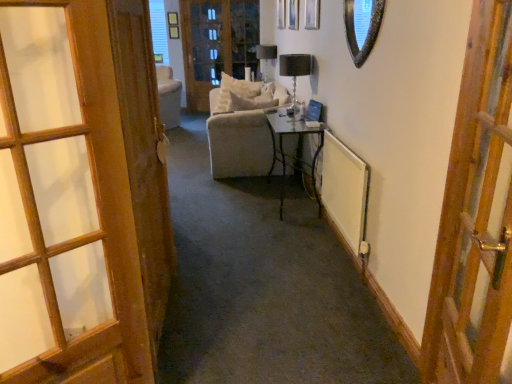
Find the location of a particular element. This screenshot has width=512, height=384. wooden door at left, acting as the first door starting from the left is located at coordinates (80, 194).

You are a GUI agent. You are given a task and a screenshot of the screen. Output one action in this format:
    pyautogui.click(x=<x>, y=<y>)
    Task: Click on the clear glass screen door at upper center
    The height and width of the screenshot is (384, 512).
    Given the screenshot: What is the action you would take?
    pyautogui.click(x=217, y=44)

What is the approximate width of black glass table lamp at center, the 2th table lamp when ordered from left to right?

The width of black glass table lamp at center, the 2th table lamp when ordered from left to right, is 8.69 inches.

Identify the location of shiny silver mirror at upper right. Image resolution: width=512 pixels, height=384 pixels. (362, 27).

The height and width of the screenshot is (384, 512). What do you see at coordinates (144, 159) in the screenshot?
I see `wooden door at left, which appears as the second door when viewed from the left` at bounding box center [144, 159].

At what (x,y) coordinates should I click in order to perform the action: click on wooden door at left, which is counted as the second door, starting from the right. Please return your answer as a coordinate pair (x, y). Looking at the image, I should click on (144, 159).

Image resolution: width=512 pixels, height=384 pixels. Describe the element at coordinates (297, 154) in the screenshot. I see `clear glass table at center` at that location.

The image size is (512, 384). I want to click on wooden door at left, acting as the first door starting from the left, so click(x=80, y=194).

Which is more to the right, black glass table lamp at center, which appears as the second table lamp when viewed from the top, or wooden door at left, which is counted as the second door, starting from the right?

black glass table lamp at center, which appears as the second table lamp when viewed from the top, is more to the right.

Is black glass table lamp at center, marked as the 1th table lamp in a right-to-left arrangement, touching wooden door at left, which appears as the second door when viewed from the left?

They are not placed beside each other.

How distant is black glass table lamp at center, the second table lamp when ordered from back to front, from wooden door at left, which appears as the second door when viewed from the left?

black glass table lamp at center, the second table lamp when ordered from back to front, is 7.39 feet away from wooden door at left, which appears as the second door when viewed from the left.

Does black glass table lamp at center, the 2th table lamp when ordered from left to right, have a greater height compared to wooden door at left, which is counted as the second door, starting from the right?

Incorrect, the height of black glass table lamp at center, the 2th table lamp when ordered from left to right, is not larger of that of wooden door at left, which is counted as the second door, starting from the right.

Would you say clear glass table at center is outside black glass table lamp at center, the second table lamp when ordered from back to front?

Yes.

Is clear glass table at center in front of or behind black glass table lamp at center, which appears as the 1th table lamp when ordered from the bottom, in the image?

Clearly, clear glass table at center is in front of black glass table lamp at center, which appears as the 1th table lamp when ordered from the bottom.

In the scene shown: Is clear glass table at center not near black glass table lamp at center, the 2th table lamp when ordered from left to right?

No, clear glass table at center is not far away from black glass table lamp at center, the 2th table lamp when ordered from left to right.

The width and height of the screenshot is (512, 384). Find the location of `table that appears on the left of black glass table lamp at center, which appears as the 1th table lamp when ordered from the bottom`. table that appears on the left of black glass table lamp at center, which appears as the 1th table lamp when ordered from the bottom is located at coordinates (297, 154).

Consider the image. Is shiny silver mirror at upper right positioned behind clear glass table at center?

No.

Considering the positions of points (349, 16) and (319, 143), is point (349, 16) farther from camera compared to point (319, 143)?

No.

Is shiny silver mirror at upper right smaller than clear glass table at center?

Yes, shiny silver mirror at upper right is smaller than clear glass table at center.

Find the location of a particular element. This screenshot has width=512, height=384. the 1st table lamp positioned above the shiny silver mirror at upper right (from the image's perspective) is located at coordinates (295, 68).

From the image's perspective, is shiny silver mirror at upper right located beneath black glass table lamp at center, marked as the 1th table lamp in a right-to-left arrangement?

Yes, from the image's perspective, shiny silver mirror at upper right is below black glass table lamp at center, marked as the 1th table lamp in a right-to-left arrangement.

Consider the image. Would you say shiny silver mirror at upper right is outside black glass table lamp at center, the 2th table lamp when ordered from left to right?

Absolutely, shiny silver mirror at upper right is external to black glass table lamp at center, the 2th table lamp when ordered from left to right.

From the image's perspective, would you say wooden door at left, which appears as the second door when viewed from the left, is shown under clear glass screen door at upper center?

Yes.

Does wooden door at left, which is counted as the second door, starting from the right, appear on the right side of clear glass screen door at upper center?

Correct, you'll find wooden door at left, which is counted as the second door, starting from the right, to the right of clear glass screen door at upper center.

Considering the relative sizes of wooden door at left, which appears as the second door when viewed from the left, and clear glass screen door at upper center in the image provided, is wooden door at left, which appears as the second door when viewed from the left, wider than clear glass screen door at upper center?

Incorrect, the width of wooden door at left, which appears as the second door when viewed from the left, does not surpass that of clear glass screen door at upper center.

Which object is closer to the camera, wooden door at right, the 3th door when ordered from left to right, or clear glass table at center?

wooden door at right, the 3th door when ordered from left to right, is closer to the camera.

Considering the points (447, 342) and (286, 112), which point is behind, point (447, 342) or point (286, 112)?

The point (286, 112) is farther.

Could you tell me if wooden door at right, the 3th door when ordered from left to right, is facing clear glass table at center?

No, wooden door at right, the 3th door when ordered from left to right, is not aimed at clear glass table at center.

Can you confirm if wooden door at right, the 3th door when ordered from left to right, is positioned to the right of clear glass table at center?

Indeed, wooden door at right, the 3th door when ordered from left to right, is positioned on the right side of clear glass table at center.

Considering the relative positions of wooden door at right, the 3th door when ordered from left to right, and shiny silver mirror at upper right in the image provided, is wooden door at right, the 3th door when ordered from left to right, to the left of shiny silver mirror at upper right from the viewer's perspective?

Incorrect, wooden door at right, the 3th door when ordered from left to right, is not on the left side of shiny silver mirror at upper right.

Between wooden door at right, the 3th door when ordered from left to right, and shiny silver mirror at upper right, which one is positioned behind?

shiny silver mirror at upper right is further away from the camera.

Could you measure the distance between wooden door at right, the 3th door when ordered from left to right, and shiny silver mirror at upper right?

wooden door at right, the 3th door when ordered from left to right, is 1.27 meters from shiny silver mirror at upper right.

From the image's perspective, which object appears higher, wooden door at right, the 3th door when ordered from left to right, or shiny silver mirror at upper right?

shiny silver mirror at upper right is shown above in the image.

From a real-world perspective, count 2nd doors downward from the black glass table lamp at center, which appears as the second table lamp when viewed from the top, and point to it. Please provide its 2D coordinates.

[(144, 159)]

From the image's perspective, which table lamp is the 1st one above the clear glass table at center? Please provide its 2D coordinates.

[(295, 68)]

In the scene shown: When comparing their distances from wooden door at right, the 3th door when ordered from left to right, does black glass table lamp at center, which appears as the second table lamp when viewed from the top, or clear glass screen door at upper center seem closer?

black glass table lamp at center, which appears as the second table lamp when viewed from the top, is closer to wooden door at right, the 3th door when ordered from left to right.

When comparing their distances from clear glass table at center, does wooden door at left, arranged as the third door when viewed from the right, or black glass table lamp at center, marked as the 1th table lamp in a right-to-left arrangement, seem further?

Based on the image, wooden door at left, arranged as the third door when viewed from the right, appears to be further to clear glass table at center.

Considering their positions, is shiny silver mirror at upper right positioned closer to black glass table lamp at center, which appears as the second table lamp when viewed from the top, than matte black table lamp at upper center, which is the second table lamp in right-to-left order?

shiny silver mirror at upper right lies closer to black glass table lamp at center, which appears as the second table lamp when viewed from the top, than the other object.

Looking at the image, which one is located closer to white soft pillow at center, matte black table lamp at upper center, which ranks as the first table lamp in left-to-right order, or shiny silver mirror at upper right?

The object closer to white soft pillow at center is matte black table lamp at upper center, which ranks as the first table lamp in left-to-right order.

Estimate the real-world distances between objects in this image. Which object is closer to clear glass table at center, wooden door at right, the 1th door viewed from the right, or wooden door at left, which is counted as the second door, starting from the right?

wooden door at left, which is counted as the second door, starting from the right.

Based on their spatial positions, is shiny silver mirror at upper right or clear glass table at center closer to wooden door at left, arranged as the third door when viewed from the right?

Based on the image, shiny silver mirror at upper right appears to be nearer to wooden door at left, arranged as the third door when viewed from the right.

Estimate the real-world distances between objects in this image. Which object is closer to wooden door at left, which is counted as the second door, starting from the right, white soft pillow at center or clear glass screen door at upper center?

Based on the image, white soft pillow at center appears to be nearer to wooden door at left, which is counted as the second door, starting from the right.

Based on their spatial positions, is wooden door at left, which is counted as the second door, starting from the right, or black glass table lamp at center, the second table lamp when ordered from back to front, closer to wooden door at left, arranged as the third door when viewed from the right?

The object closer to wooden door at left, arranged as the third door when viewed from the right, is wooden door at left, which is counted as the second door, starting from the right.

Where is `table between wooden door at right, the 1th door viewed from the right, and matte black table lamp at upper center, acting as the 1th table lamp starting from the back, from front to back`? The height and width of the screenshot is (384, 512). table between wooden door at right, the 1th door viewed from the right, and matte black table lamp at upper center, acting as the 1th table lamp starting from the back, from front to back is located at coordinates (297, 154).

The image size is (512, 384). Find the location of `door between wooden door at left, arranged as the third door when viewed from the right, and shiny silver mirror at upper right from left to right`. door between wooden door at left, arranged as the third door when viewed from the right, and shiny silver mirror at upper right from left to right is located at coordinates (144, 159).

Locate an element on the screen. The height and width of the screenshot is (384, 512). pillow located between wooden door at right, the 3th door when ordered from left to right, and clear glass screen door at upper center in the depth direction is located at coordinates 237,94.

Where is `mirror between wooden door at right, the 3th door when ordered from left to right, and black glass table lamp at center, the 2th table lamp when ordered from left to right, in the front-back direction`? mirror between wooden door at right, the 3th door when ordered from left to right, and black glass table lamp at center, the 2th table lamp when ordered from left to right, in the front-back direction is located at coordinates (362, 27).